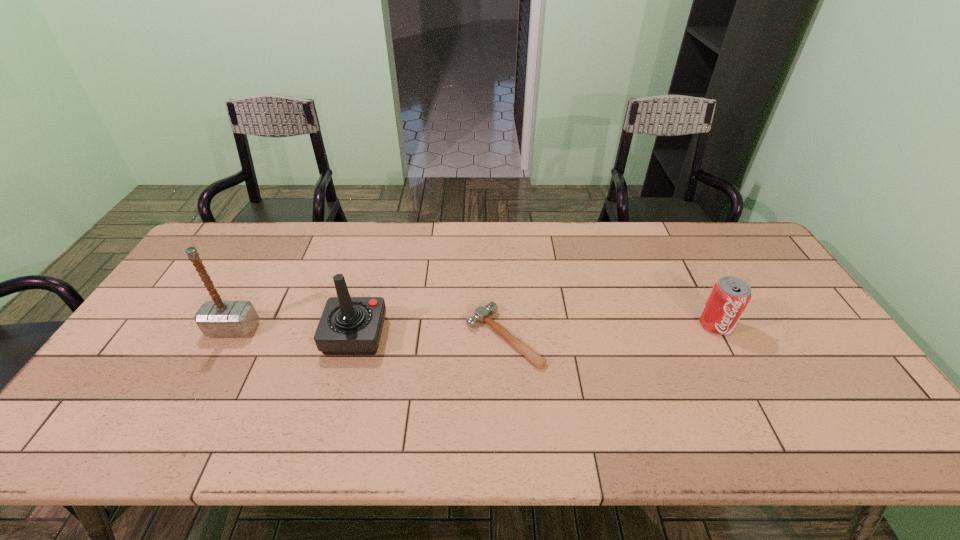
What are the coordinates of `free region located on the back of the second shortest object` in the screenshot? It's located at coord(681,259).

Identify the location of vacant space located on the front of the right hammer. (508, 413).

You are a GUI agent. You are given a task and a screenshot of the screen. Output one action in this format:
    pyautogui.click(x=<x>, y=<y>)
    Task: Click on the vacant space at the far edge of the desktop
    The image size is (960, 540).
    Given the screenshot: What is the action you would take?
    pyautogui.click(x=392, y=225)

Where is `free space at the near edge`? The image size is (960, 540). free space at the near edge is located at coordinates (273, 442).

The width and height of the screenshot is (960, 540). In order to click on free region at the left edge in this screenshot , I will do `click(106, 388)`.

This screenshot has height=540, width=960. In order to click on vacant region between the leftmost object and the joystick in this screenshot , I will do `click(294, 332)`.

Where is `blank region between the rightmost object and the second object from left to right`? blank region between the rightmost object and the second object from left to right is located at coordinates (536, 329).

Identify the location of empty space between the joystick and the tallest object. The image size is (960, 540). (294, 332).

This screenshot has width=960, height=540. I want to click on free area in between the second shortest object and the second tallest object, so click(x=536, y=329).

The width and height of the screenshot is (960, 540). In order to click on blank region between the joystick and the shorter hammer in this screenshot , I will do `click(429, 336)`.